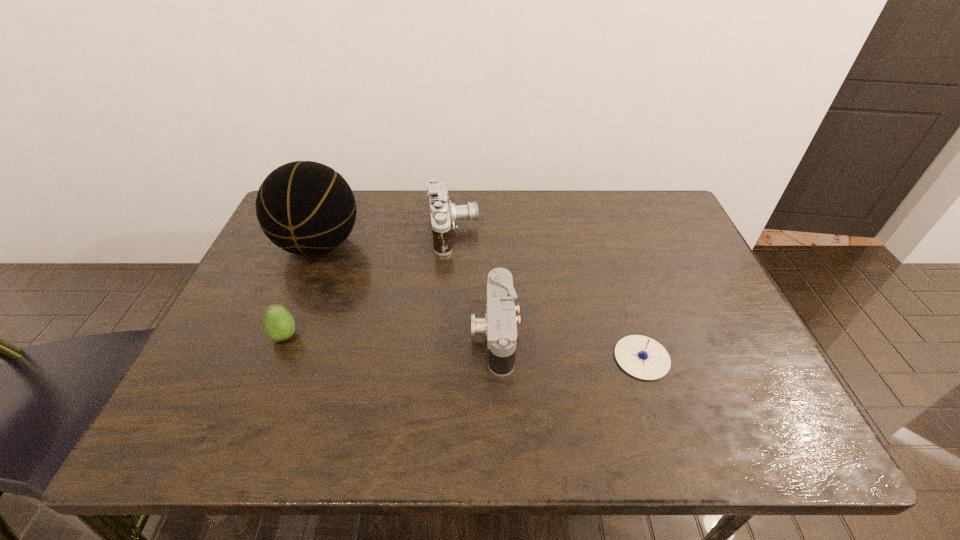
Where is `free spot between the avocado and the basketball`? This screenshot has height=540, width=960. free spot between the avocado and the basketball is located at coordinates (302, 291).

The width and height of the screenshot is (960, 540). In order to click on free space between the compass and the nearer camera in this screenshot , I will do `click(568, 346)`.

Select which object is the second closest to the farther camera. Please provide its 2D coordinates. Your answer should be formatted as a tuple, i.e. [(x, y)], where the tuple contains the x and y coordinates of a point satisfying the conditions above.

[(306, 208)]

The height and width of the screenshot is (540, 960). I want to click on the second closest object to the shortest object, so [x=444, y=214].

Find the location of a particular element. vacant region that satisfies the following two spatial constraints: 1. at the lens of the farther camera; 2. on the back side of the compass is located at coordinates (444, 357).

Locate an element on the screen. The height and width of the screenshot is (540, 960). vacant space that satisfies the following two spatial constraints: 1. on the front side of the compass; 2. on the left side of the basketball is located at coordinates (274, 357).

What are the coordinates of `vacant area in the image that satisfies the following two spatial constraints: 1. on the back side of the shortest object; 2. at the lens of the farther camera` in the screenshot? It's located at (602, 232).

Locate an element on the screen. Image resolution: width=960 pixels, height=540 pixels. free region that satisfies the following two spatial constraints: 1. on the lens of the nearer camera; 2. on the front side of the avocado is located at coordinates (494, 336).

Where is `free space that satisfies the following two spatial constraints: 1. on the lens of the nearer camera; 2. on the left side of the compass`? free space that satisfies the following two spatial constraints: 1. on the lens of the nearer camera; 2. on the left side of the compass is located at coordinates pyautogui.click(x=495, y=357).

The width and height of the screenshot is (960, 540). What are the coordinates of `vacant area that satisfies the following two spatial constraints: 1. on the lens of the compass; 2. on the right side of the nearer camera` in the screenshot? It's located at (495, 357).